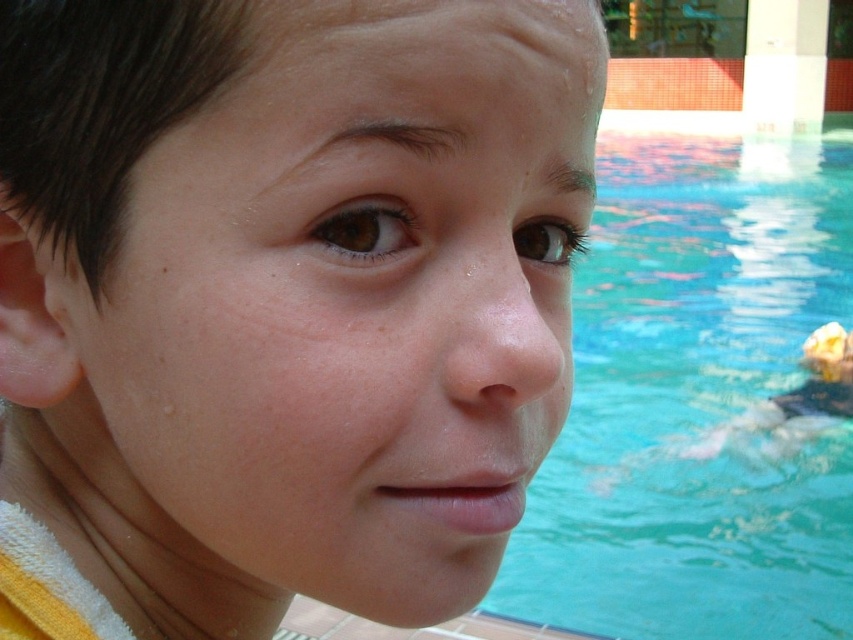
Question: Is dry skin at center positioned in front of blue water at center?

Choices:
 (A) no
 (B) yes

Answer: (B)

Question: Which point is farther to the camera?

Choices:
 (A) (531, 394)
 (B) (845, 460)

Answer: (B)

Question: Can you confirm if dry skin at center is positioned below blue water at center?

Choices:
 (A) yes
 (B) no

Answer: (A)

Question: Which point is closer to the camera?

Choices:
 (A) (735, 518)
 (B) (321, 96)

Answer: (B)

Question: Which point is closer to the camera taking this photo?

Choices:
 (A) (766, 540)
 (B) (90, 397)

Answer: (B)

Question: Does dry skin at center appear under blue water at center?

Choices:
 (A) yes
 (B) no

Answer: (A)